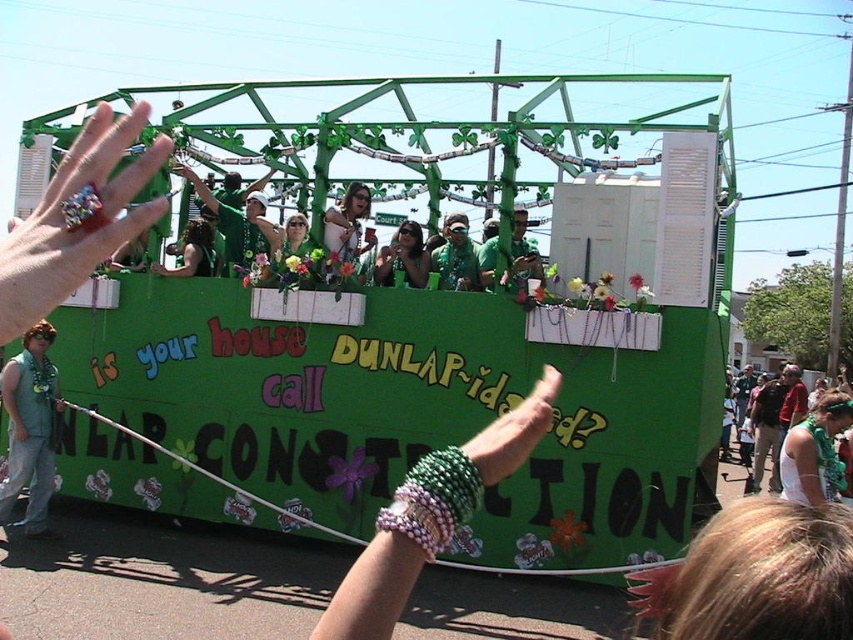
Who is lower down, shiny silver sunglasses at center or green fabric shirt at center?

shiny silver sunglasses at center

Can you confirm if shiny silver sunglasses at center is bigger than green fabric shirt at center?

Incorrect, shiny silver sunglasses at center is not larger than green fabric shirt at center.

The height and width of the screenshot is (640, 853). I want to click on shiny silver sunglasses at center, so click(346, 227).

Who is positioned more to the left, green fabric headband at upper right or shiny green shirt at center?

From the viewer's perspective, shiny green shirt at center appears more on the left side.

What do you see at coordinates (814, 451) in the screenshot? I see `green fabric headband at upper right` at bounding box center [814, 451].

This screenshot has height=640, width=853. Describe the element at coordinates (814, 451) in the screenshot. I see `green fabric headband at upper right` at that location.

Find the location of `green fabric headband at upper right`. green fabric headband at upper right is located at coordinates (814, 451).

Can you confirm if green fabric vest at left is positioned to the right of matte green sunglasses at center?

Incorrect, green fabric vest at left is not on the right side of matte green sunglasses at center.

Is point (35, 410) positioned before point (392, 243)?

That is True.

Identify the location of green fabric vest at left. (30, 426).